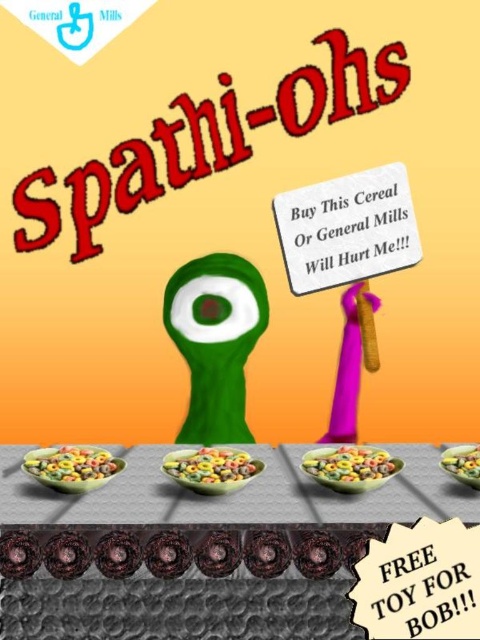
Question: Does white paper sign at center lie in front of smooth plastic bowl at center?

Choices:
 (A) no
 (B) yes

Answer: (A)

Question: In this image, where is gray textured table at center located relative to multicolored cereal at center?

Choices:
 (A) below
 (B) above

Answer: (A)

Question: Does colorful cereal at lower left appear under smooth plastic bowl at center?

Choices:
 (A) no
 (B) yes

Answer: (B)

Question: Based on their relative distances, which object is farther from the multicolored glossy cereal bowl at center?

Choices:
 (A) white paper sign at center
 (B) gray textured table at center
 (C) smooth plastic bowl at center

Answer: (A)

Question: Among these objects, which one is farthest from the camera?

Choices:
 (A) gray textured table at center
 (B) smooth plastic bowl at center
 (C) multicolored cereal at center
 (D) white paper sign at center

Answer: (D)

Question: Which point is farther from the camera taking this photo?

Choices:
 (A) (302, 275)
 (B) (468, 468)

Answer: (A)